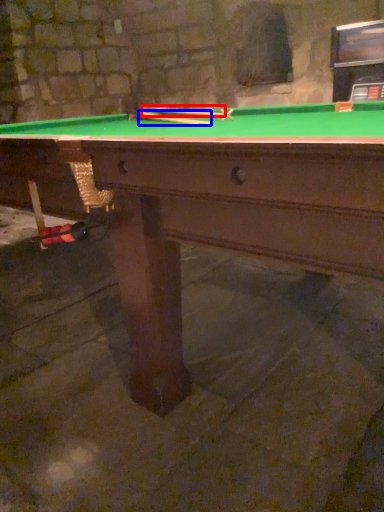
Question: Which of the following is the closest to the observer, cue (highlighted by a red box) or cue (highlighted by a blue box)?

Choices:
 (A) cue
 (B) cue

Answer: (B)